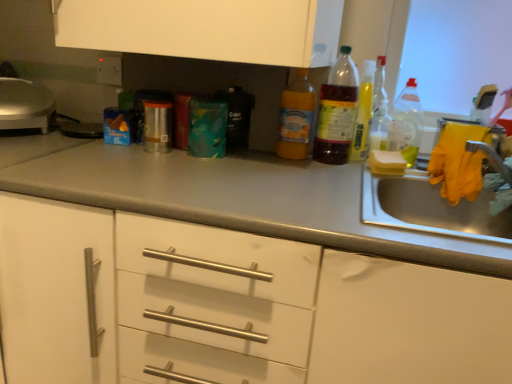
The width and height of the screenshot is (512, 384). I want to click on vacant area that is situated to the right of translucent plastic bottle at center, the 2th bottle in the left-to-right sequence, so click(379, 169).